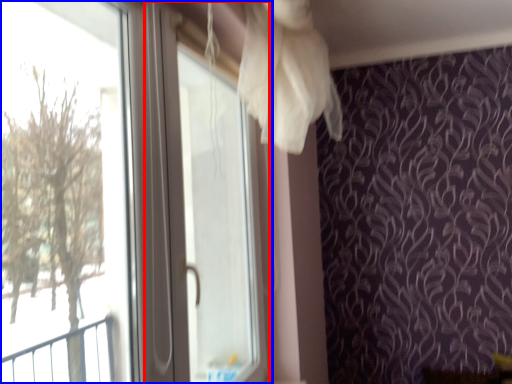
Question: Which point is closer to the camera, screen door (highlighted by a red box) or window (highlighted by a blue box)?

Choices:
 (A) screen door
 (B) window

Answer: (B)